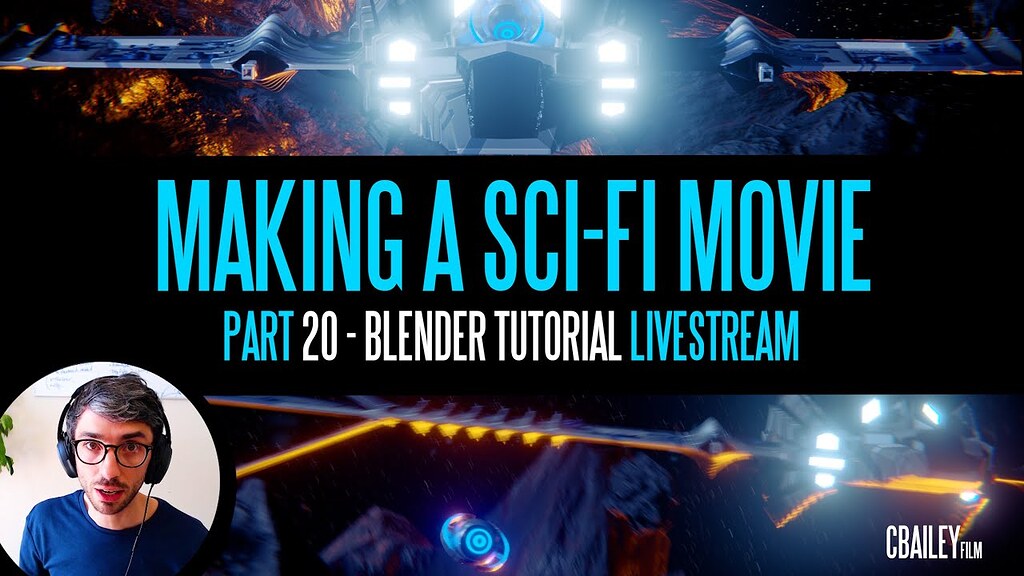
Locate an element on the screen. This screenshot has height=576, width=1024. green plant leaves is located at coordinates (0, 445), (7, 420), (4, 458).